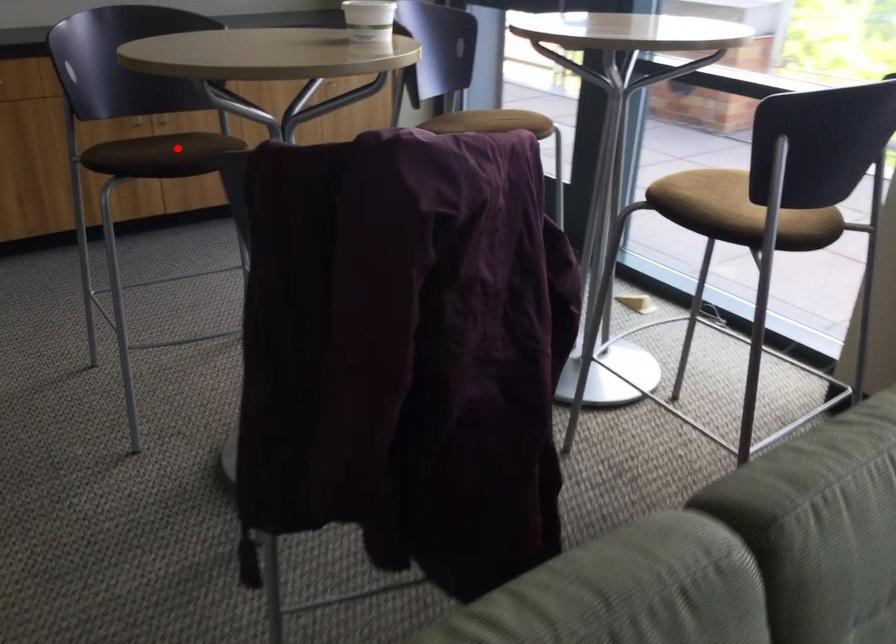
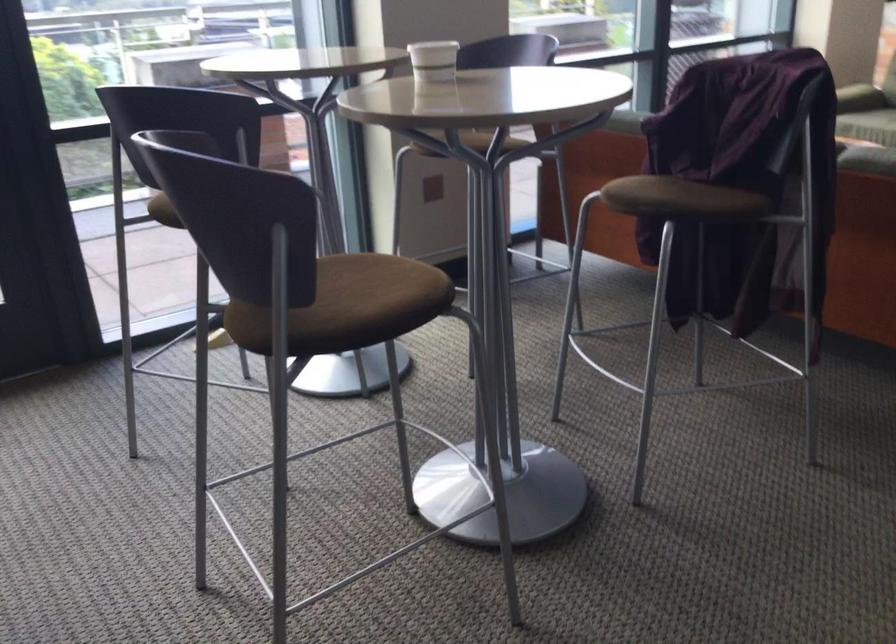
The point at the highlighted location is marked in the first image. Where is the corresponding point in the second image?

(371, 292)